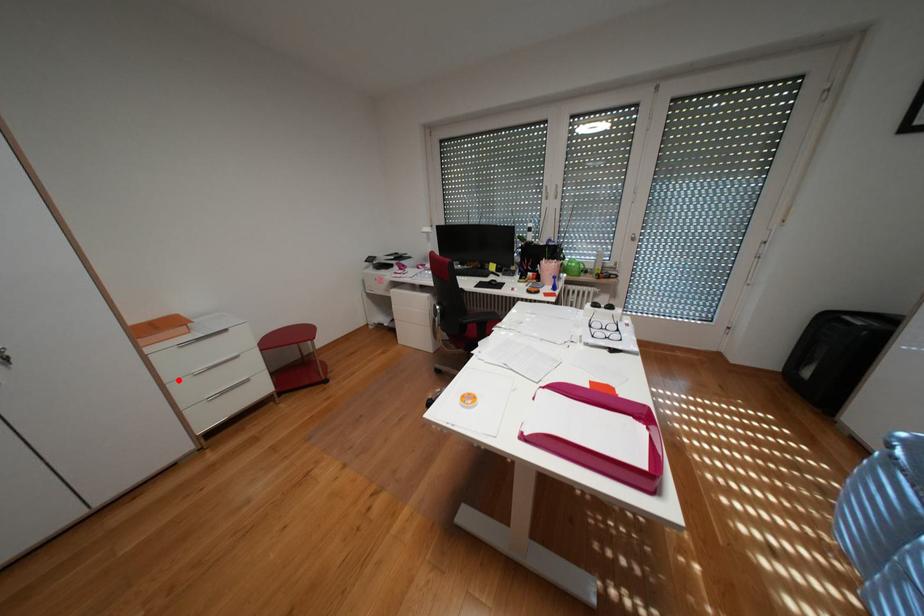
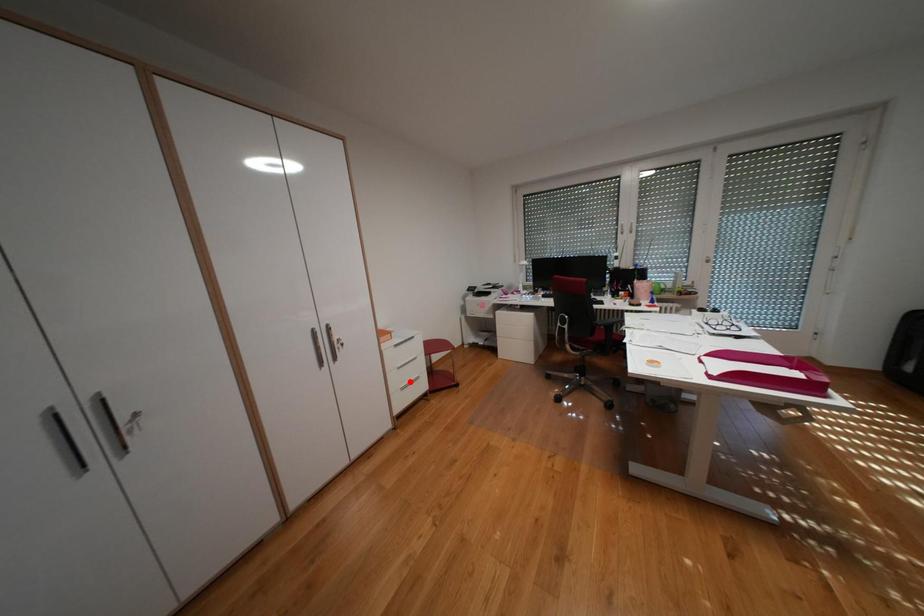
I am providing you with two images of the same scene from different viewpoints. A red point is marked on the first image and another point is marked on the second image. Is the red point in image1 aligned with the point shown in image2?

No